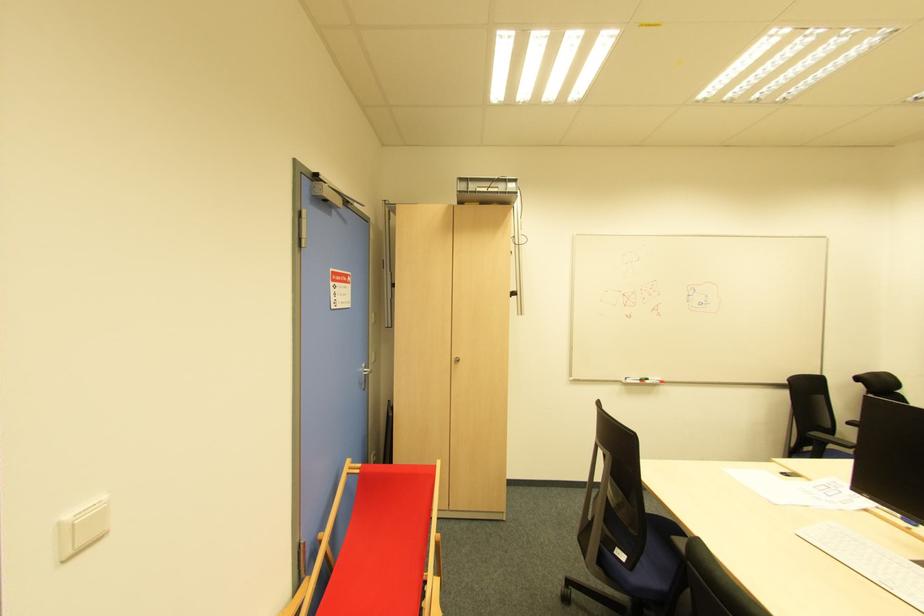
At what (x,y) coordinates should I click in order to perform the action: click on white light switch. Please return your answer as a coordinate pair (x, y). The width and height of the screenshot is (924, 616). Looking at the image, I should click on (81, 528).